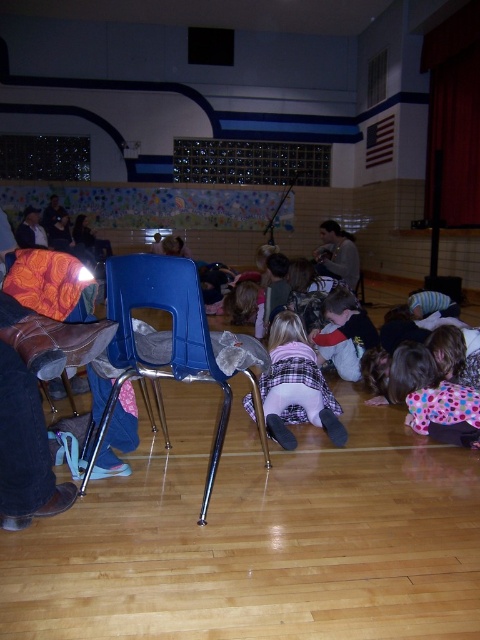
Does blue plastic chair at center lie behind polka dot fabric dress at lower right?

No.

In order to click on blue plastic chair at center in this screenshot , I will do `click(171, 330)`.

Is point (217, 454) less distant than point (453, 442)?

Yes, it is.

The image size is (480, 640). I want to click on blue plastic chair at center, so click(x=171, y=330).

Does plaid fabric pants at center appear under polka dot fabric dress at lower right?

Incorrect, plaid fabric pants at center is not positioned below polka dot fabric dress at lower right.

This screenshot has height=640, width=480. Identify the location of plaid fabric pants at center. (296, 385).

At what (x,y) coordinates should I click in order to perform the action: click on plaid fabric pants at center. Please return your answer as a coordinate pair (x, y). This screenshot has width=480, height=640. Looking at the image, I should click on (296, 385).

What do you see at coordinates (171, 330) in the screenshot? Image resolution: width=480 pixels, height=640 pixels. I see `blue plastic chair at center` at bounding box center [171, 330].

Is blue plastic chair at center further to the viewer compared to plaid fabric pants at center?

No, it is in front of plaid fabric pants at center.

In order to click on blue plastic chair at center in this screenshot , I will do `click(171, 330)`.